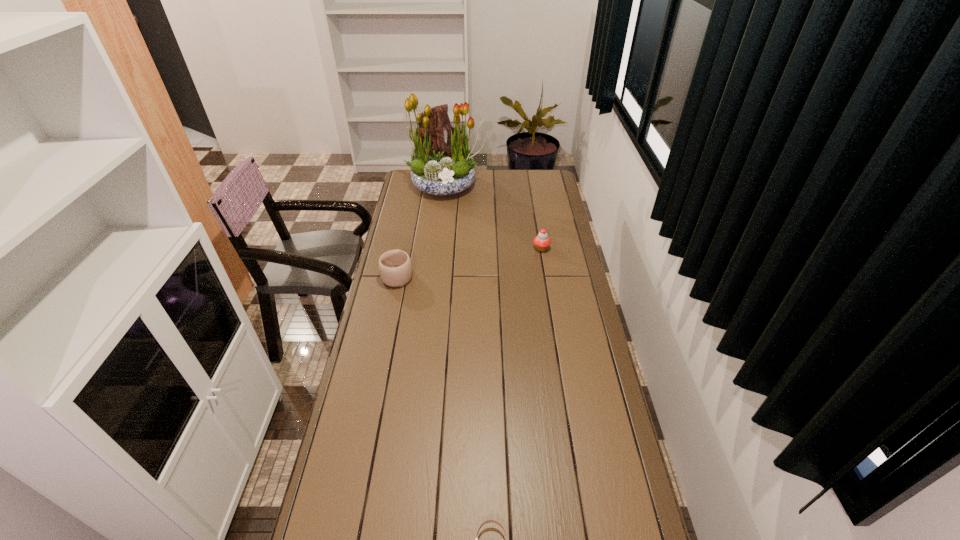
Find the location of a particular element. free location that satisfies the following two spatial constraints: 1. on the side of the mug with the handle; 2. on the left side of the rightmost object is located at coordinates (403, 248).

The width and height of the screenshot is (960, 540). What are the coordinates of `free location that satisfies the following two spatial constraints: 1. on the side of the third nearest object with the handle; 2. on the right side of the third farthest object` in the screenshot? It's located at (403, 248).